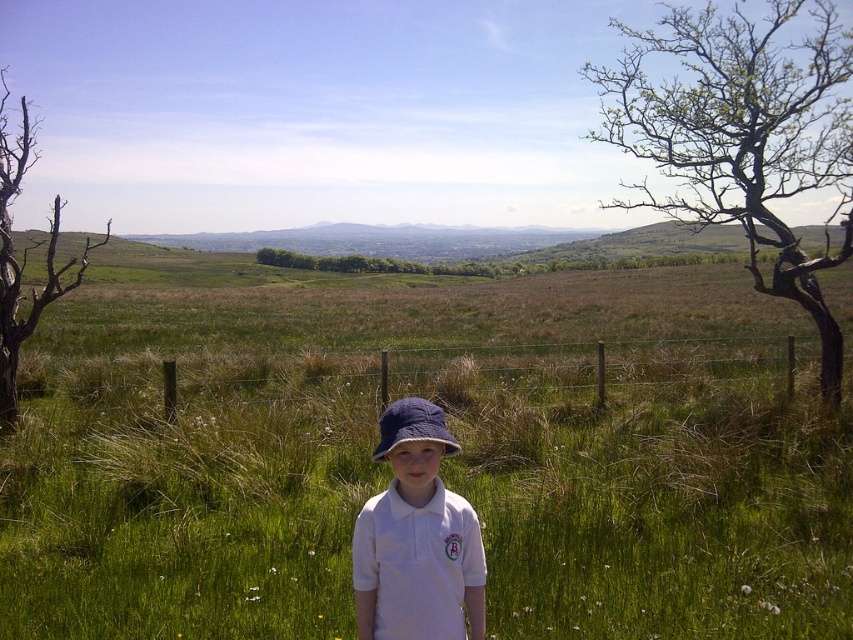
Question: Which of these objects is positioned closest to the bare wood tree at upper right?

Choices:
 (A) white cotton shirt at center
 (B) brown dead wood at left

Answer: (A)

Question: Which of the following is the closest to the observer?

Choices:
 (A) (25, 125)
 (B) (375, 528)
 (C) (612, 131)

Answer: (B)

Question: Does bare wood tree at upper right have a smaller size compared to brown dead wood at left?

Choices:
 (A) yes
 (B) no

Answer: (A)

Question: Is bare wood tree at upper right positioned before blue fabric hat at center?

Choices:
 (A) no
 (B) yes

Answer: (A)

Question: Estimate the real-world distances between objects in this image. Which object is closer to the brown dead wood at left?

Choices:
 (A) bare wood tree at upper right
 (B) blue fabric hat at center

Answer: (A)

Question: Is bare wood tree at upper right thinner than blue fabric hat at center?

Choices:
 (A) no
 (B) yes

Answer: (A)